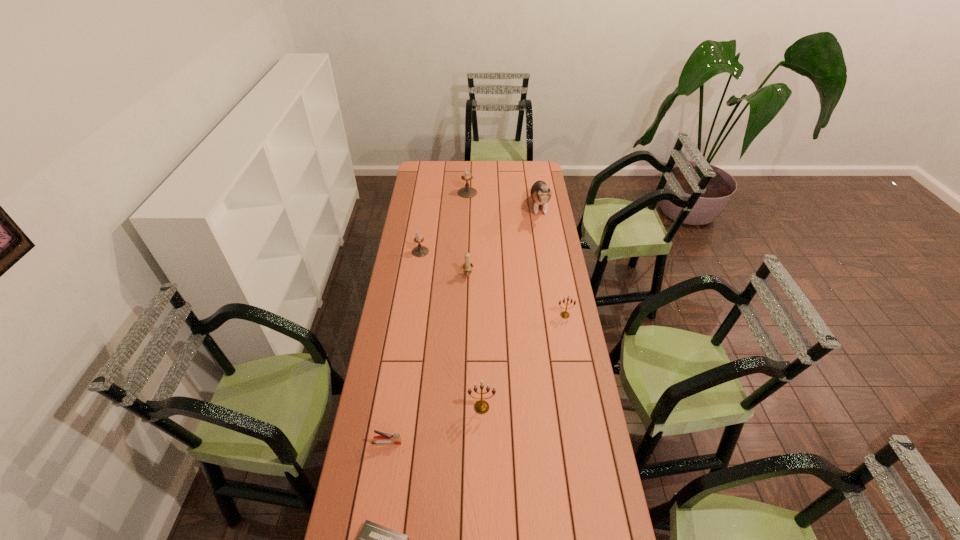
At what (x,y) coordinates should I click in order to perform the action: click on stapler present at the left edge. Please return your answer as a coordinate pair (x, y). Looking at the image, I should click on (383, 438).

Find the location of a particular element. cat present at the right edge is located at coordinates (540, 192).

Where is `candelabrum that is at the right edge`? candelabrum that is at the right edge is located at coordinates (564, 314).

Identify the location of vacant space at the far edge of the desktop. (493, 165).

The width and height of the screenshot is (960, 540). Identify the location of free location at the left edge. (348, 530).

Locate an element on the screen. This screenshot has height=540, width=960. free space at the right edge of the desktop is located at coordinates (538, 244).

Locate an element on the screen. The width and height of the screenshot is (960, 540). free space at the far right corner of the desktop is located at coordinates (530, 176).

This screenshot has height=540, width=960. I want to click on vacant point located between the fourth farthest object and the cat, so click(503, 241).

Image resolution: width=960 pixels, height=540 pixels. I want to click on free space between the left gold candelabrum and the right gold candelabrum, so click(523, 361).

This screenshot has width=960, height=540. I want to click on empty space between the farther purple candle holder and the third nearest candelabrum, so click(468, 234).